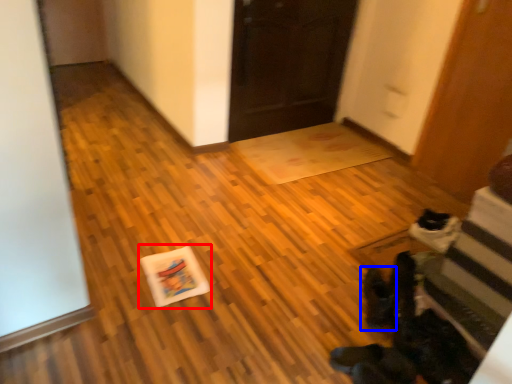
Question: Among these objects, which one is farthest to the camera, postcard (highlighted by a red box) or footwear (highlighted by a blue box)?

Choices:
 (A) postcard
 (B) footwear

Answer: (A)